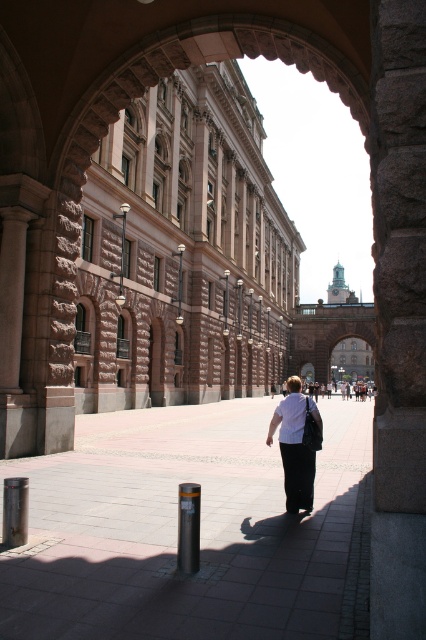
Question: Does smooth concrete pavement at center appear over black polished metal post at center?

Choices:
 (A) no
 (B) yes

Answer: (A)

Question: Which object is closer to the camera taking this photo?

Choices:
 (A) white matte shirt at center
 (B) smooth concrete pavement at center

Answer: (B)

Question: Does smooth concrete pavement at center have a larger size compared to black polished metal post at center?

Choices:
 (A) no
 (B) yes

Answer: (B)

Question: Which of the following is the farthest from the observer?

Choices:
 (A) smooth concrete pavement at center
 (B) white matte shirt at center
 (C) black polished metal post at center

Answer: (B)

Question: Estimate the real-world distances between objects in this image. Which object is closer to the smooth concrete pavement at center?

Choices:
 (A) white matte shirt at center
 (B) black polished metal post at center

Answer: (A)

Question: Does white matte shirt at center have a larger size compared to black polished metal post at center?

Choices:
 (A) yes
 (B) no

Answer: (A)